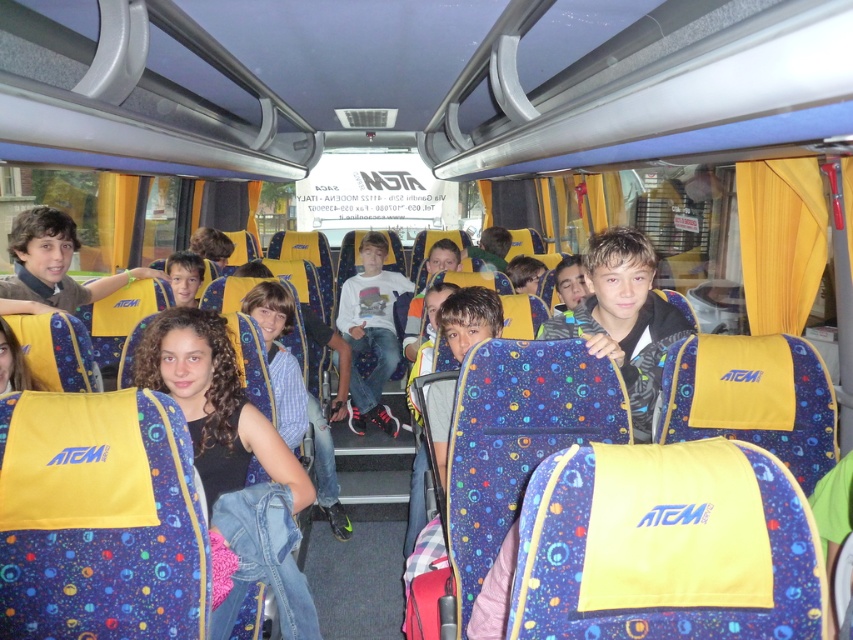
Is dark brown hair at center to the left of white cotton shirt at center from the viewer's perspective?

Indeed, dark brown hair at center is positioned on the left side of white cotton shirt at center.

Where is `dark brown hair at center`? The height and width of the screenshot is (640, 853). dark brown hair at center is located at coordinates (213, 403).

Does dark brown hair at center have a greater width compared to blue denim jeans at center?

Yes.

Is dark brown hair at center smaller than blue denim jeans at center?

No.

Image resolution: width=853 pixels, height=640 pixels. What are the coordinates of `dark brown hair at center` in the screenshot? It's located at (213, 403).

Locate an element on the screen. The height and width of the screenshot is (640, 853). dark brown hair at center is located at coordinates (213, 403).

Is white cotton shirt at center shorter than blue denim jeans at center?

Incorrect, white cotton shirt at center's height does not fall short of blue denim jeans at center's.

Is point (381, 355) behind point (317, 474)?

Yes, point (381, 355) is farther from viewer.

Locate an element on the screen. This screenshot has height=640, width=853. white cotton shirt at center is located at coordinates (370, 332).